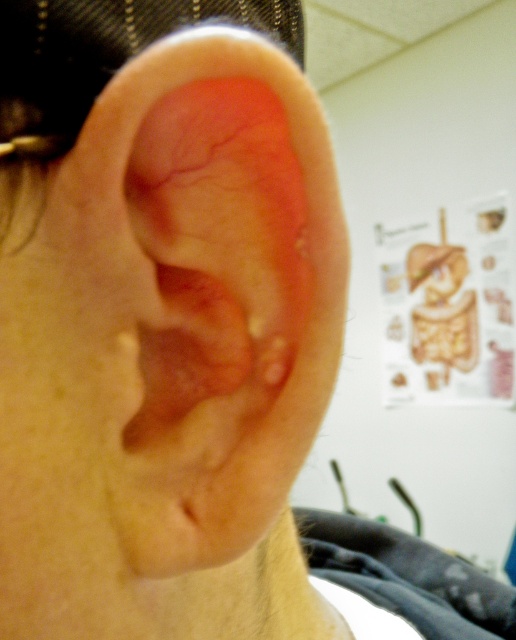
You are a medical student examining the ear in the image. The point marked at coordinates (194, 340) is part of the ear. Based on the description, what is the color of the area at this point?

The point at (194, 340) corresponds to pink flesh at center, which is described as inflamed and reddened. Therefore, the area at this point is pink and shows signs of inflammation.